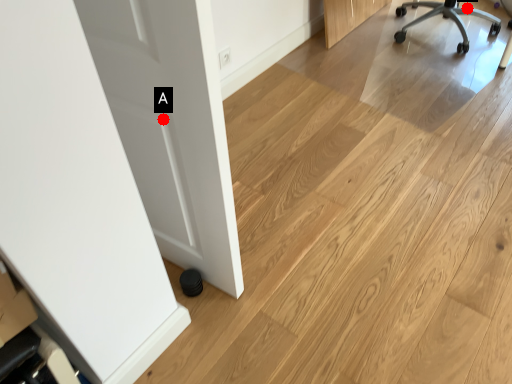
Question: Two points are circled on the image, labeled by A and B beside each circle. Which of the following is the farthest from the observer?

Choices:
 (A) A is further
 (B) B is further

Answer: (B)